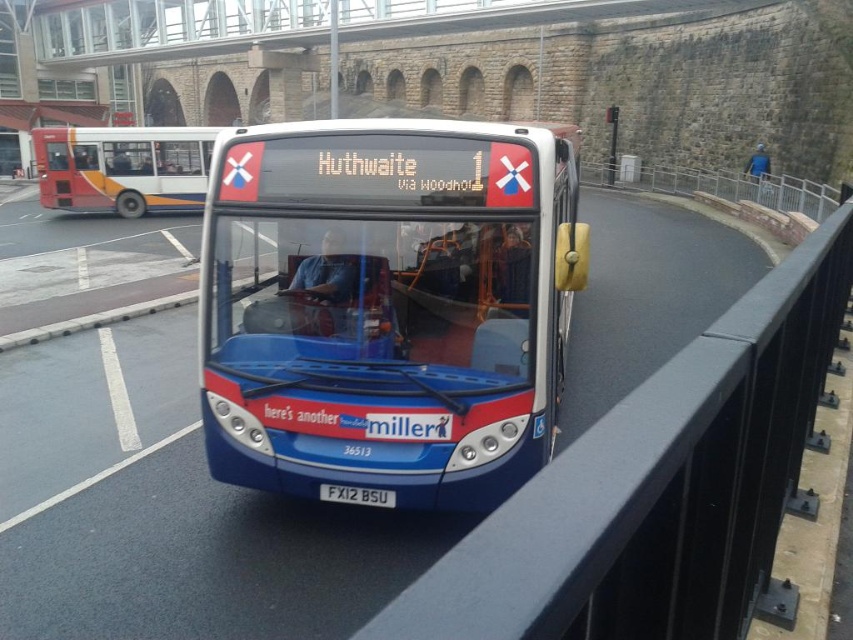
Between metal at center and matte red bus at left, which one appears on the left side from the viewer's perspective?

Result: From the viewer's perspective, matte red bus at left appears more on the left side.

Does metal at center have a lesser height compared to matte red bus at left?

Yes, metal at center is shorter than matte red bus at left.

Measure the distance between point (502, 534) and camera.

35.38 inches

Where is `metal at center`? metal at center is located at coordinates (657, 486).

Who is more forward, (276, 400) or (560, 552)?

Point (560, 552) is more forward.

Can you confirm if blue metallic bus at center is positioned to the left of metal at center?

Indeed, blue metallic bus at center is positioned on the left side of metal at center.

This screenshot has width=853, height=640. In order to click on blue metallic bus at center in this screenshot , I will do coord(387,307).

The image size is (853, 640). Find the location of `blue metallic bus at center`. blue metallic bus at center is located at coordinates (387, 307).

The width and height of the screenshot is (853, 640). In order to click on matte red bus at left in this screenshot , I will do `click(122, 168)`.

Is point (169, 179) behind point (376, 497)?

Yes, it is behind point (376, 497).

Locate an element on the screen. This screenshot has width=853, height=640. matte red bus at left is located at coordinates (122, 168).